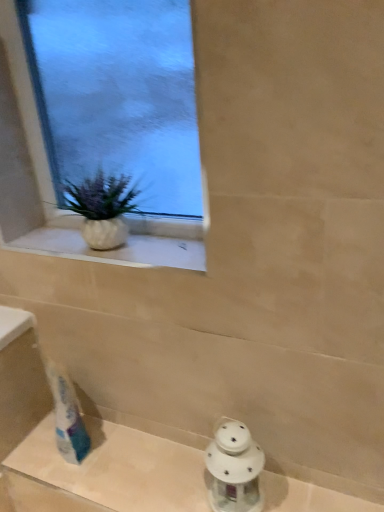
Question: Should I look upward or downward to see white glass lantern at lower center?

Choices:
 (A) up
 (B) down

Answer: (B)

Question: Is white porcelain lantern at lower right positioned beyond the bounds of clear glass window at upper left?

Choices:
 (A) no
 (B) yes

Answer: (B)

Question: Is white porcelain lantern at lower right in front of clear glass window at upper left?

Choices:
 (A) no
 (B) yes

Answer: (A)

Question: Could you tell me if white porcelain lantern at lower right is turned towards clear glass window at upper left?

Choices:
 (A) no
 (B) yes

Answer: (A)

Question: Is white porcelain lantern at lower right surrounding clear glass window at upper left?

Choices:
 (A) no
 (B) yes

Answer: (A)

Question: Is white porcelain lantern at lower right placed right next to clear glass window at upper left?

Choices:
 (A) no
 (B) yes

Answer: (A)

Question: Does white porcelain lantern at lower right appear on the right side of clear glass window at upper left?

Choices:
 (A) yes
 (B) no

Answer: (A)

Question: Is white glass lantern at lower center turned away from white porcelain lantern at lower right?

Choices:
 (A) yes
 (B) no

Answer: (B)

Question: Considering the relative sizes of white glass lantern at lower center and white porcelain lantern at lower right in the image provided, is white glass lantern at lower center thinner than white porcelain lantern at lower right?

Choices:
 (A) yes
 (B) no

Answer: (B)

Question: From a real-world perspective, is white glass lantern at lower center positioned under white porcelain lantern at lower right based on gravity?

Choices:
 (A) yes
 (B) no

Answer: (A)

Question: Considering the relative positions of white glass lantern at lower center and white porcelain lantern at lower right in the image provided, is white glass lantern at lower center to the right of white porcelain lantern at lower right from the viewer's perspective?

Choices:
 (A) yes
 (B) no

Answer: (B)

Question: Does white glass lantern at lower center lie in front of white porcelain lantern at lower right?

Choices:
 (A) yes
 (B) no

Answer: (A)

Question: From the image's perspective, is white glass lantern at lower center on top of white porcelain lantern at lower right?

Choices:
 (A) yes
 (B) no

Answer: (B)

Question: Is clear glass window at upper left turned away from white textured vase at upper left?

Choices:
 (A) no
 (B) yes

Answer: (B)